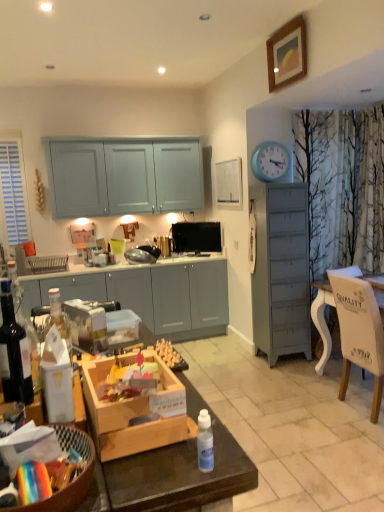
Question: Is black glossy television at upper center further to camera compared to satin black toaster at center?

Choices:
 (A) yes
 (B) no

Answer: (A)

Question: Is black glossy television at upper center thinner than satin black toaster at center?

Choices:
 (A) yes
 (B) no

Answer: (A)

Question: From the image's perspective, is black glossy television at upper center on satin black toaster at center?

Choices:
 (A) no
 (B) yes

Answer: (B)

Question: Is the depth of black glossy television at upper center less than that of satin black toaster at center?

Choices:
 (A) yes
 (B) no

Answer: (B)

Question: Is black glossy television at upper center oriented away from satin black toaster at center?

Choices:
 (A) yes
 (B) no

Answer: (B)

Question: From the image's perspective, relative to white matte picture frame at upper center, which is the 1th picture frame from bottom to top, is satin black toaster at center above or below?

Choices:
 (A) below
 (B) above

Answer: (A)

Question: Considering the relative positions of satin black toaster at center and white matte picture frame at upper center, which is the second picture frame in right-to-left order, in the image provided, is satin black toaster at center to the left or to the right of white matte picture frame at upper center, which is the second picture frame in right-to-left order,?

Choices:
 (A) left
 (B) right

Answer: (A)

Question: Is satin black toaster at center wider or thinner than white matte picture frame at upper center, which is the 1th picture frame from bottom to top?

Choices:
 (A) thin
 (B) wide

Answer: (B)

Question: Is point (130, 251) positioned closer to the camera than point (231, 176)?

Choices:
 (A) closer
 (B) farther

Answer: (B)

Question: From a real-world perspective, is blue plastic clock at upper right above or below wooden picture frame at upper center, which ranks as the first picture frame in top-to-bottom order?

Choices:
 (A) above
 (B) below

Answer: (B)

Question: From the image's perspective, relative to wooden picture frame at upper center, arranged as the 2th picture frame when viewed from the left, is blue plastic clock at upper right above or below?

Choices:
 (A) below
 (B) above

Answer: (A)

Question: Considering their positions, is blue plastic clock at upper right located in front of or behind wooden picture frame at upper center, the 2th picture frame from the bottom?

Choices:
 (A) front
 (B) behind

Answer: (B)

Question: Is point (271, 180) closer or farther from the camera than point (299, 69)?

Choices:
 (A) closer
 (B) farther

Answer: (B)

Question: Considering the positions of wooden corded phone at center and translucent glass bottle at left, placed as the second bottle when sorted from bottom to top, in the image, is wooden corded phone at center taller or shorter than translucent glass bottle at left, placed as the second bottle when sorted from bottom to top,?

Choices:
 (A) tall
 (B) short

Answer: (A)

Question: Does point (125, 220) appear closer or farther from the camera than point (11, 369)?

Choices:
 (A) farther
 (B) closer

Answer: (A)